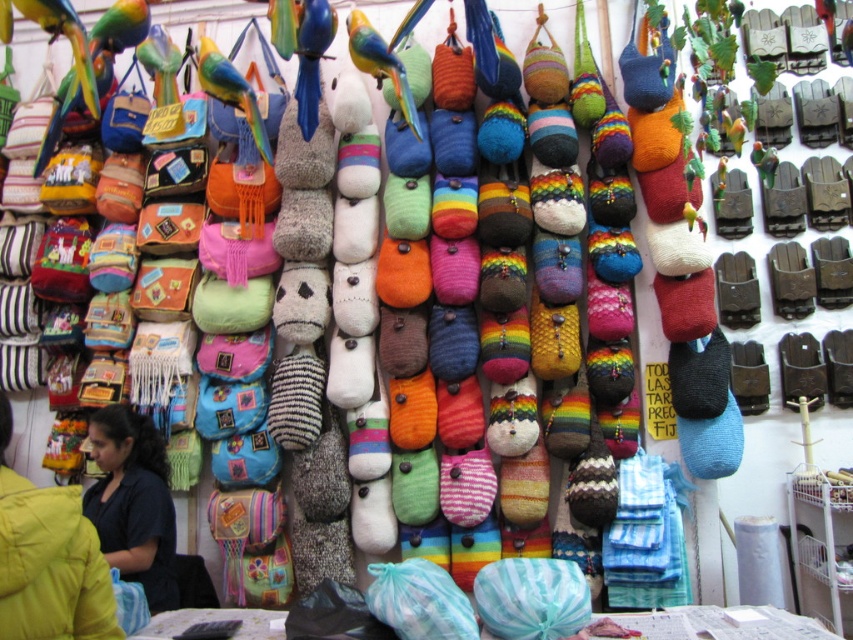
Does point (25, 630) come behind point (111, 497)?

No, it is in front of (111, 497).

Who is more forward, (12, 570) or (154, 534)?

Point (12, 570)

Between point (111, 632) and point (148, 588), which one is positioned in front?

Point (111, 632) is in front.

Locate an element on the screen. The width and height of the screenshot is (853, 640). black fabric at lower left is located at coordinates (48, 560).